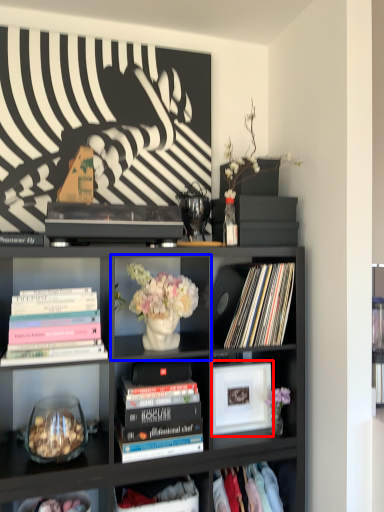
Question: Which object is closer to the camera taking this photo, picture frame (highlighted by a red box) or shelf (highlighted by a blue box)?

Choices:
 (A) picture frame
 (B) shelf

Answer: (B)